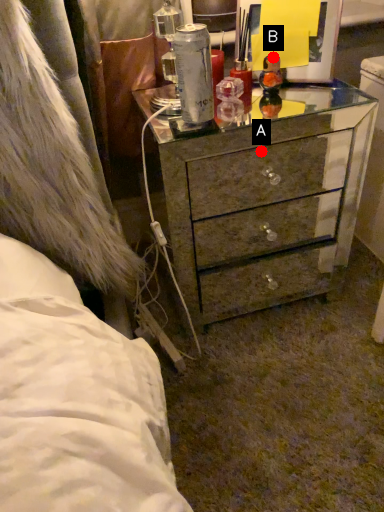
Question: Two points are circled on the image, labeled by A and B beside each circle. Among these points, which one is farthest from the camera?

Choices:
 (A) A is further
 (B) B is further

Answer: (A)